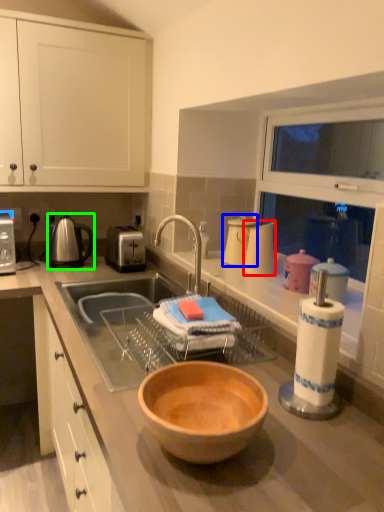
Question: Estimate the real-world distances between objects in this image. Which object is closer to appliance (highlighted by a red box), appliance (highlighted by a blue box) or tea pot (highlighted by a green box)?

Choices:
 (A) appliance
 (B) tea pot

Answer: (A)